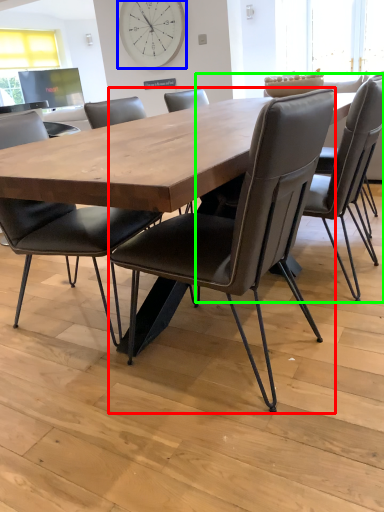
Question: Estimate the real-world distances between objects in this image. Which object is farther from chair (highlighted by a red box), clock (highlighted by a blue box) or chair (highlighted by a green box)?

Choices:
 (A) clock
 (B) chair

Answer: (A)